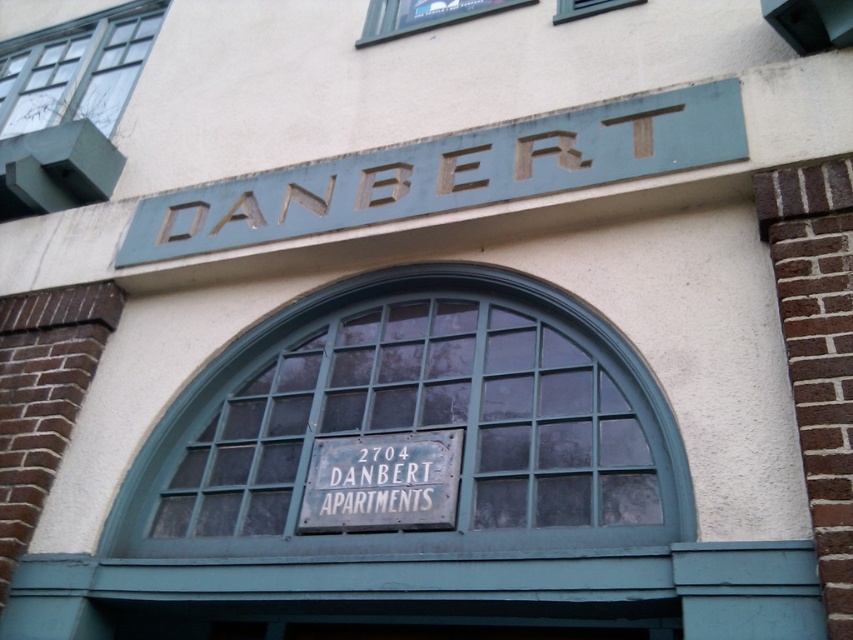
Question: Can you confirm if green painted metal sign at upper center is wider than white metal sign at center?

Choices:
 (A) no
 (B) yes

Answer: (B)

Question: Does green painted metal sign at upper center have a smaller size compared to white metal sign at center?

Choices:
 (A) yes
 (B) no

Answer: (B)

Question: Can you confirm if green painted metal sign at upper center is positioned to the left of white metal sign at center?

Choices:
 (A) no
 (B) yes

Answer: (A)

Question: Among these objects, which one is nearest to the camera?

Choices:
 (A) white metal sign at center
 (B) green painted metal sign at upper center

Answer: (A)